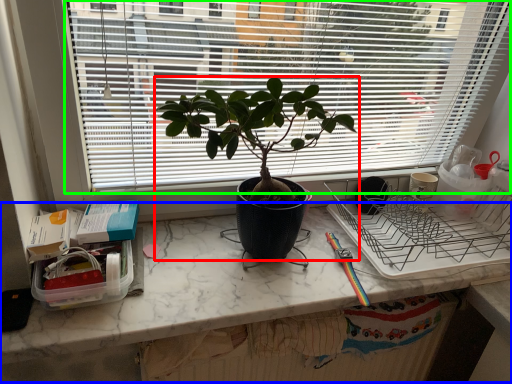
Question: Estimate the real-world distances between objects in this image. Which object is closer to houseplant (highlighted by a red box), computer desk (highlighted by a blue box) or window (highlighted by a green box)?

Choices:
 (A) computer desk
 (B) window

Answer: (B)